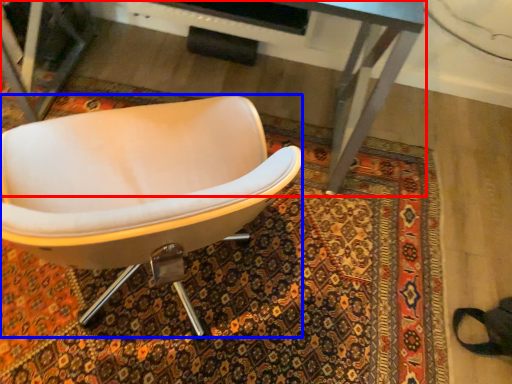
Question: Among these objects, which one is farthest to the camera, desk (highlighted by a red box) or chair (highlighted by a blue box)?

Choices:
 (A) desk
 (B) chair

Answer: (A)